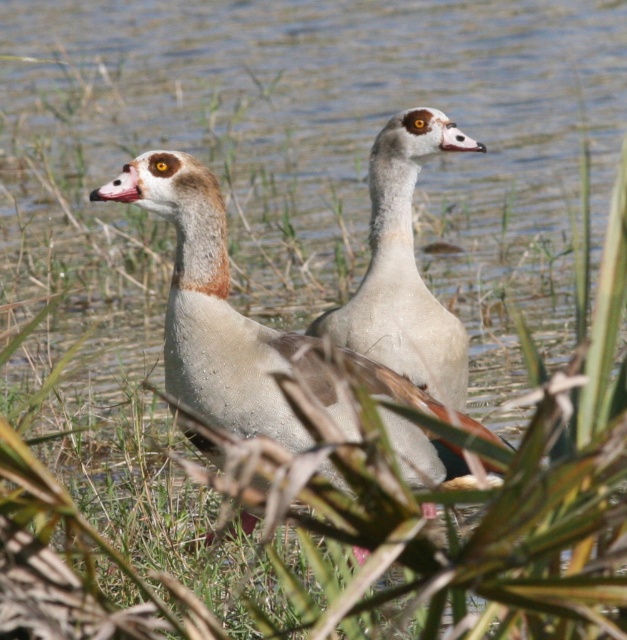
You are observing two birds in the water. The white matte duck at center and the white matte goose at center. Which one is shorter?

The white matte duck at center is shorter than the white matte goose at center.

You are a birdwatcher observing the scene and want to mark the exact location of the white matte duck at center on a grid. What are the coordinates where you should place your marker?

The coordinates for the white matte duck at center are at point (219, 314).

You are standing at the edge of a pond and see a white matte duck at center. What is located at the coordinates point (219, 314)?

The white matte duck at center is located at point (219, 314).